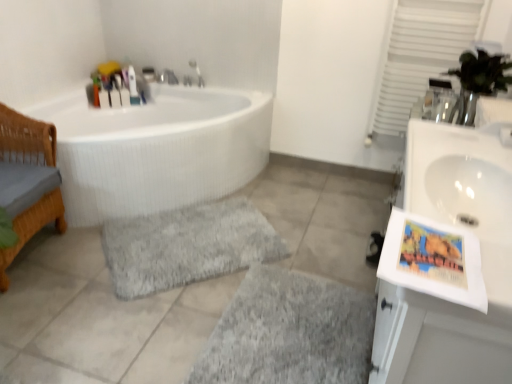
Where is `translucent plastic container at upper left, which is the third toiletry in left-to-right order`? translucent plastic container at upper left, which is the third toiletry in left-to-right order is located at coordinates (124, 96).

Measure the distance between point (118,95) and camera.

A distance of 3.17 meters exists between point (118,95) and camera.

This screenshot has width=512, height=384. What do you see at coordinates (156, 149) in the screenshot?
I see `white glossy bathtub at left` at bounding box center [156, 149].

The image size is (512, 384). What do you see at coordinates (105, 95) in the screenshot?
I see `translucent plastic bottles at upper left, which appears as the 1th toiletry when viewed from the left` at bounding box center [105, 95].

This screenshot has height=384, width=512. Find the location of `gray shaggy rug at center, arranged as the first bath mat when ordered from the bottom`. gray shaggy rug at center, arranged as the first bath mat when ordered from the bottom is located at coordinates (290, 332).

I want to click on woven wood basket at left, so click(x=26, y=135).

Is translucent plastic container at upper left, which is the third toiletry in left-to-right order, surrounding matte plastic bottle at upper left, which is the second toiletry in left-to-right order?

No, matte plastic bottle at upper left, which is the second toiletry in left-to-right order, is located outside of translucent plastic container at upper left, which is the third toiletry in left-to-right order.

Relative to matte plastic bottle at upper left, positioned as the third toiletry in right-to-left order, is translucent plastic container at upper left, acting as the second toiletry starting from the right, in front or behind?

In the image, translucent plastic container at upper left, acting as the second toiletry starting from the right, appears behind matte plastic bottle at upper left, positioned as the third toiletry in right-to-left order.

From the image's perspective, count 1st toiletrys upward from the matte plastic bottle at upper left, positioned as the third toiletry in right-to-left order, and point to it. Please provide its 2D coordinates.

[(124, 96)]

From the image's perspective, is translucent plastic container at upper left, acting as the second toiletry starting from the right, below matte plastic bottle at upper left, which is the second toiletry in left-to-right order?

No.

Does translucent plastic container at upper left, acting as the second toiletry starting from the right, appear on the right side of gray shaggy bath mat at center, the first bath mat positioned from the top?

No.

Considering the sizes of translucent plastic container at upper left, acting as the second toiletry starting from the right, and gray shaggy bath mat at center, positioned as the second bath mat in bottom-to-top order, in the image, is translucent plastic container at upper left, acting as the second toiletry starting from the right, taller or shorter than gray shaggy bath mat at center, positioned as the second bath mat in bottom-to-top order,?

translucent plastic container at upper left, acting as the second toiletry starting from the right, is taller than gray shaggy bath mat at center, positioned as the second bath mat in bottom-to-top order.

In the scene shown: From the image's perspective, which is above, translucent plastic container at upper left, acting as the second toiletry starting from the right, or gray shaggy bath mat at center, positioned as the second bath mat in bottom-to-top order?

translucent plastic container at upper left, acting as the second toiletry starting from the right, from the image's perspective.

Is translucent plastic container at upper left, acting as the second toiletry starting from the right, positioned with its back to gray shaggy bath mat at center, positioned as the second bath mat in bottom-to-top order?

That's not correct — translucent plastic container at upper left, acting as the second toiletry starting from the right, is not looking away from gray shaggy bath mat at center, positioned as the second bath mat in bottom-to-top order.

Looking at their sizes, would you say matte plastic toothbrush at upper left, the first toiletry positioned from the right, is wider or thinner than matte silver faucet at upper center?

In the image, matte plastic toothbrush at upper left, the first toiletry positioned from the right, appears to be more narrow than matte silver faucet at upper center.

Based on the photo, can you confirm if matte plastic toothbrush at upper left, which is counted as the 4th toiletry, starting from the left, is smaller than matte silver faucet at upper center?

Yes.

From the image's perspective, which one is positioned lower, matte plastic toothbrush at upper left, which is counted as the 4th toiletry, starting from the left, or matte silver faucet at upper center?

matte plastic toothbrush at upper left, which is counted as the 4th toiletry, starting from the left, from the image's perspective.

Is matte plastic toothbrush at upper left, the first toiletry positioned from the right, not near matte silver faucet at upper center?

No, matte plastic toothbrush at upper left, the first toiletry positioned from the right, is in close proximity to matte silver faucet at upper center.

Considering the relative sizes of matte plastic toothbrush at upper left, which is counted as the 4th toiletry, starting from the left, and matte plastic bottle at upper left, positioned as the third toiletry in right-to-left order, in the image provided, is matte plastic toothbrush at upper left, which is counted as the 4th toiletry, starting from the left, shorter than matte plastic bottle at upper left, positioned as the third toiletry in right-to-left order,?

Incorrect, the height of matte plastic toothbrush at upper left, which is counted as the 4th toiletry, starting from the left, does not fall short of that of matte plastic bottle at upper left, positioned as the third toiletry in right-to-left order.

Is matte plastic toothbrush at upper left, the first toiletry positioned from the right, bigger than matte plastic bottle at upper left, which is the second toiletry in left-to-right order?

Yes.

Can you tell me how much matte plastic toothbrush at upper left, which is counted as the 4th toiletry, starting from the left, and matte plastic bottle at upper left, which is the second toiletry in left-to-right order, differ in facing direction?

The angular difference between matte plastic toothbrush at upper left, which is counted as the 4th toiletry, starting from the left, and matte plastic bottle at upper left, which is the second toiletry in left-to-right order, is 0.0018 degrees.

Between point (134, 79) and point (111, 98), which one is positioned behind?

Point (134, 79)

The width and height of the screenshot is (512, 384). What are the coordinates of `sink in front of the matte plastic bottle at upper left, which is the second toiletry in left-to-right order` in the screenshot? It's located at (459, 178).

Measure the distance between matte plastic bottle at upper left, which is the second toiletry in left-to-right order, and white glossy sink at right.

A distance of 8.24 feet exists between matte plastic bottle at upper left, which is the second toiletry in left-to-right order, and white glossy sink at right.

Is matte plastic bottle at upper left, which is the second toiletry in left-to-right order, smaller than white glossy sink at right?

Yes.

Is white glossy sink at right located within matte plastic bottle at upper left, positioned as the third toiletry in right-to-left order?

No, white glossy sink at right is located outside of matte plastic bottle at upper left, positioned as the third toiletry in right-to-left order.

Which object is thinner, matte plastic toothbrush at upper left, which is counted as the 4th toiletry, starting from the left, or white glossy bathtub at left?

matte plastic toothbrush at upper left, which is counted as the 4th toiletry, starting from the left.

From a real-world perspective, which is physically above, matte plastic toothbrush at upper left, the first toiletry positioned from the right, or white glossy bathtub at left?

In real-world perspective, matte plastic toothbrush at upper left, the first toiletry positioned from the right, is above.

Considering the relative positions of matte plastic toothbrush at upper left, which is counted as the 4th toiletry, starting from the left, and white glossy bathtub at left in the image provided, is matte plastic toothbrush at upper left, which is counted as the 4th toiletry, starting from the left, to the right of white glossy bathtub at left from the viewer's perspective?

No.

Is point (131, 86) positioned in front of point (236, 179)?

No.

From a real-world perspective, is woven wood basket at left physically located above or below white glossy bathtub at left?

woven wood basket at left is above white glossy bathtub at left.

Is point (59, 190) closer or farther from the camera than point (251, 126)?

Point (59, 190).

Is woven wood basket at left thinner than white glossy bathtub at left?

Yes.

From the image's perspective, starting from the translucent plastic container at upper left, which is the third toiletry in left-to-right order, which toiletry is the 1st one below? Please provide its 2D coordinates.

[(115, 97)]

In order to click on the 1st toiletry positioned above the gray shaggy bath mat at center, the first bath mat positioned from the top (from a real-world perspective) in this screenshot , I will do `click(124, 96)`.

Which object lies nearer to the anchor point matte silver faucet at upper center, gray shaggy rug at center, arranged as the first bath mat when ordered from the bottom, or matte plastic toothbrush at upper left, the first toiletry positioned from the right?

matte plastic toothbrush at upper left, the first toiletry positioned from the right, lies closer to matte silver faucet at upper center than the other object.

Looking at this image, when comparing their distances from translucent plastic bottles at upper left, which appears as the 1th toiletry when viewed from the left, does white glossy bathtub at left or matte plastic bottle at upper left, positioned as the third toiletry in right-to-left order, seem further?

Among the two, white glossy bathtub at left is located further to translucent plastic bottles at upper left, which appears as the 1th toiletry when viewed from the left.

Looking at the image, which one is located closer to white glossy sink at right, matte plastic toothbrush at upper left, which is counted as the 4th toiletry, starting from the left, or matte silver faucet at upper center?

The object closer to white glossy sink at right is matte silver faucet at upper center.

When comparing their distances from matte plastic bottle at upper left, which is the second toiletry in left-to-right order, does woven wood basket at left or gray shaggy rug at center, which is counted as the second bath mat, starting from the top, seem further?

gray shaggy rug at center, which is counted as the second bath mat, starting from the top.

Considering their positions, is translucent plastic container at upper left, acting as the second toiletry starting from the right, positioned further to white glossy sink at right than matte plastic toothbrush at upper left, the first toiletry positioned from the right?

translucent plastic container at upper left, acting as the second toiletry starting from the right, is positioned further to the anchor white glossy sink at right.

When comparing their distances from matte plastic bottle at upper left, which is the second toiletry in left-to-right order, does translucent plastic bottles at upper left, which is the 4th toiletry from right to left, or white glossy bathtub at left seem closer?

translucent plastic bottles at upper left, which is the 4th toiletry from right to left, is positioned closer to the anchor matte plastic bottle at upper left, which is the second toiletry in left-to-right order.

From the image, which object appears to be farther from white glossy sink at right, matte silver faucet at upper center or gray shaggy bath mat at center, positioned as the second bath mat in bottom-to-top order?

Based on the image, matte silver faucet at upper center appears to be further to white glossy sink at right.

Considering their positions, is woven wood basket at left positioned closer to matte silver faucet at upper center than translucent plastic bottles at upper left, which appears as the 1th toiletry when viewed from the left?

Among the two, translucent plastic bottles at upper left, which appears as the 1th toiletry when viewed from the left, is located nearer to matte silver faucet at upper center.

Locate an element on the screen. The height and width of the screenshot is (384, 512). bathtub located between woven wood basket at left and matte silver faucet at upper center in the depth direction is located at coordinates (156, 149).

Locate an element on the screen. The width and height of the screenshot is (512, 384). bathtub located between woven wood basket at left and matte plastic toothbrush at upper left, which is counted as the 4th toiletry, starting from the left, in the depth direction is located at coordinates (156, 149).

Image resolution: width=512 pixels, height=384 pixels. Find the location of `toiletry located between gray shaggy rug at center, arranged as the first bath mat when ordered from the bottom, and matte plastic bottle at upper left, which is the second toiletry in left-to-right order, in the depth direction`. toiletry located between gray shaggy rug at center, arranged as the first bath mat when ordered from the bottom, and matte plastic bottle at upper left, which is the second toiletry in left-to-right order, in the depth direction is located at coordinates (105, 95).

Where is `tap located between gray shaggy bath mat at center, the first bath mat positioned from the top, and translucent plastic container at upper left, which is the third toiletry in left-to-right order, in the depth direction`? tap located between gray shaggy bath mat at center, the first bath mat positioned from the top, and translucent plastic container at upper left, which is the third toiletry in left-to-right order, in the depth direction is located at coordinates (197, 73).